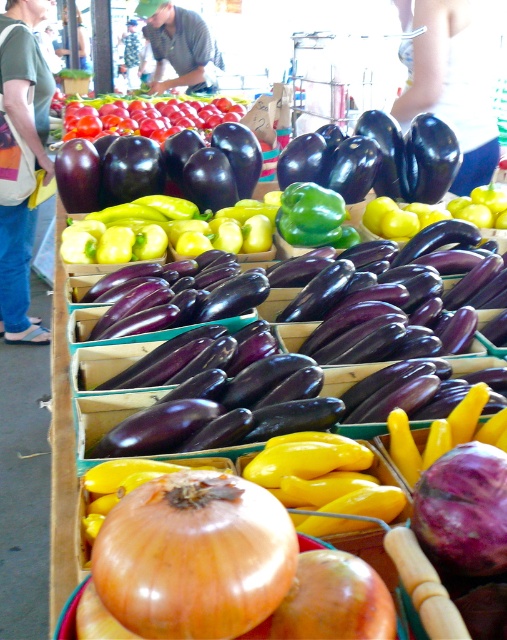
You are a vendor at the farmer market and need to place a price tag on both the matte green shirt at upper left and the smooth purple onion at center. Which object requires a larger price tag?

The matte green shirt at upper left requires a larger price tag because it is bigger than the smooth purple onion at center.

You are standing at the entrance of the farmer market. You see a point marked at coordinate (194,556). What object is located at that point?

The point at coordinate (194,556) corresponds to the smooth orange onion at center.

You are a customer at the farmer market and want to buy both the matte green shirt at upper left and the smooth purple onion at center. The store has a rule that if one item is wider than the other, you can only buy the wider one. Which item can you purchase?

The matte green shirt at upper left is wider than the smooth purple onion at center, so you can only purchase the matte green shirt at upper left.